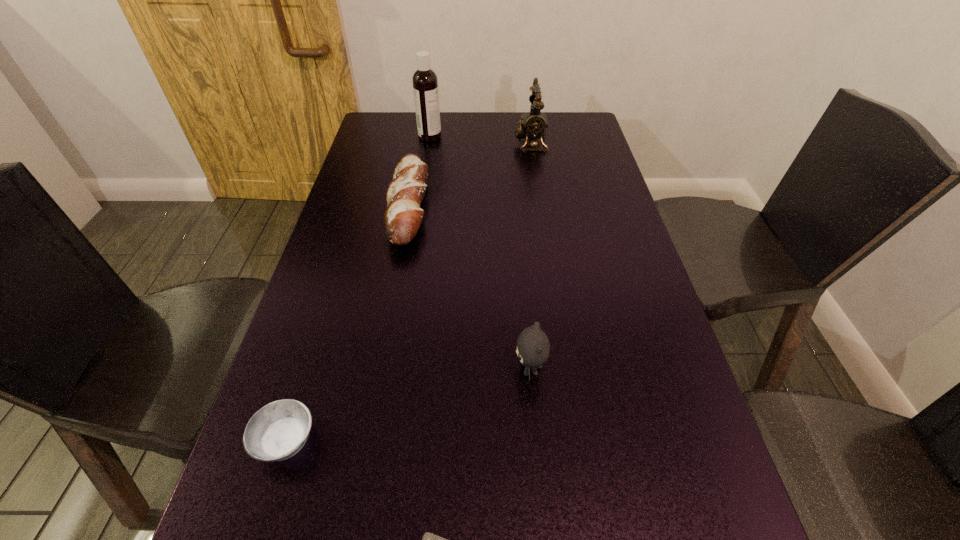
You are a GUI agent. You are given a task and a screenshot of the screen. Output one action in this format:
    pyautogui.click(x=<x>, y=<y>)
    Task: Click on the free space that is in between the ashtray and the third farthest object
    The width and height of the screenshot is (960, 540).
    Given the screenshot: What is the action you would take?
    pyautogui.click(x=348, y=323)

This screenshot has width=960, height=540. What are the coordinates of `free space between the telephone and the second shortest object` in the screenshot? It's located at (408, 292).

Where is `free space between the baguet and the ashtray`? free space between the baguet and the ashtray is located at coordinates coord(348,323).

Identify which object is located as the fifth nearest to the fifth shortest object. Please provide its 2D coordinates. Your answer should be formatted as a tuple, i.e. [(x, y)], where the tuple contains the x and y coordinates of a point satisfying the conditions above.

[(429, 539)]

Choose which object is the nearest neighbor to the fourth shortest object. Please provide its 2D coordinates. Your answer should be formatted as a tuple, i.e. [(x, y)], where the tuple contains the x and y coordinates of a point satisfying the conditions above.

[(429, 539)]

I want to click on vacant area in the image that satisfies the following two spatial constraints: 1. on the label side of the dishwasher detergent; 2. on the front side of the ashtray, so (x=382, y=441).